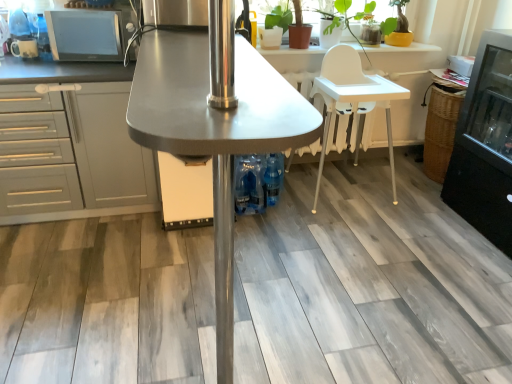
The image size is (512, 384). I want to click on free space between blue plastic bottles at center and metallic gray table at center, positioned as the 2th table in right-to-left order, so click(x=267, y=265).